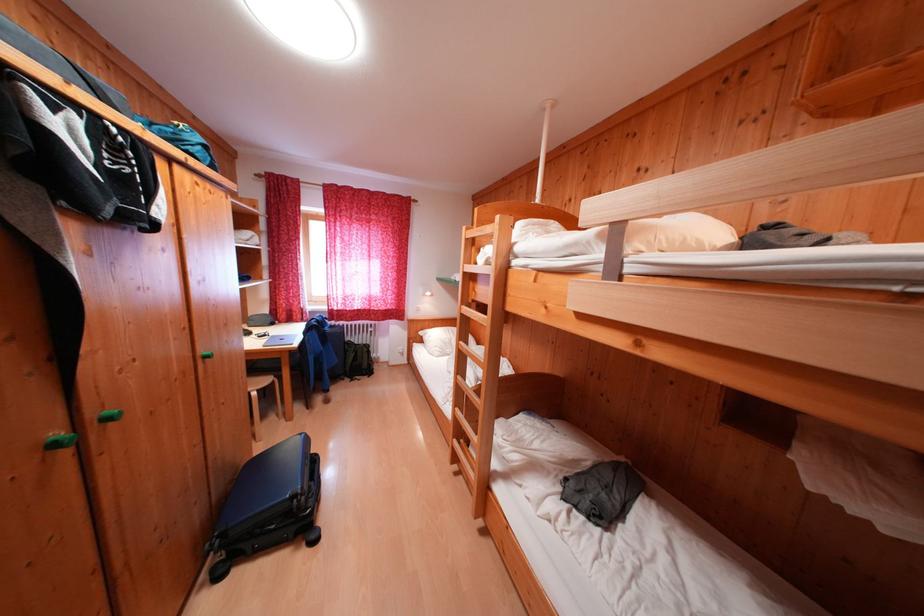
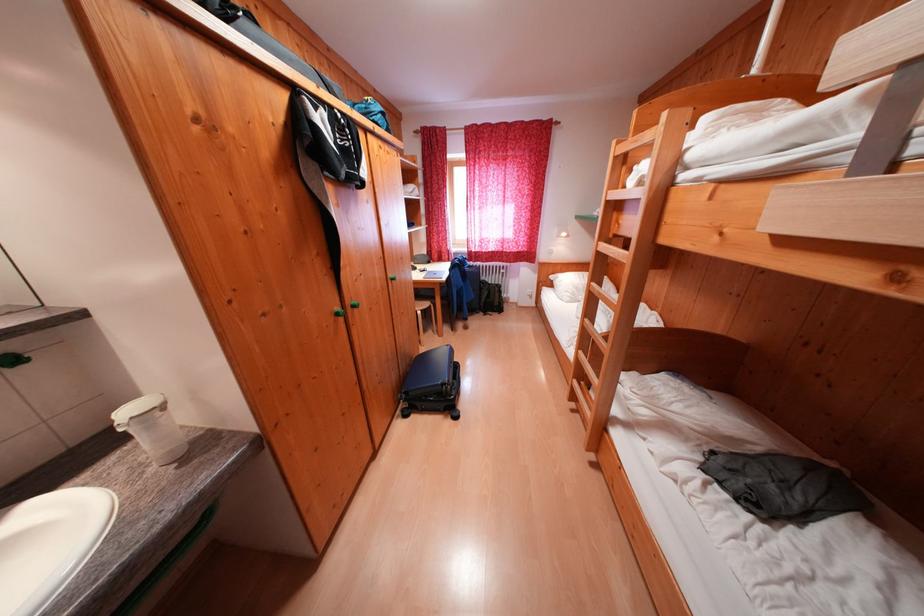
Find the pixel in the second image that matches [310,492] in the first image.

(456, 384)